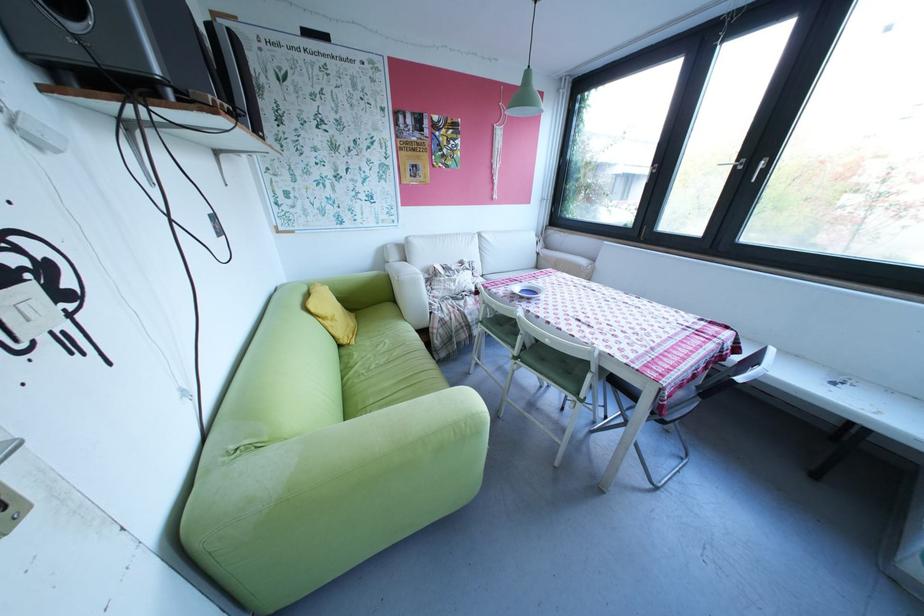
Describe the element at coordinates (404, 277) in the screenshot. I see `a white sofa armrest` at that location.